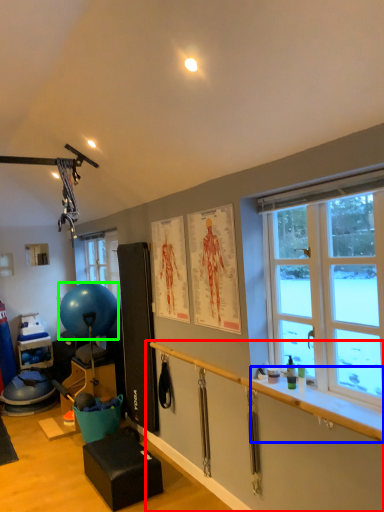
Question: Estimate the real-world distances between objects in this image. Which object is closer to garage door (highlighted by a red box), window sill (highlighted by a blue box) or ball (highlighted by a green box)?

Choices:
 (A) window sill
 (B) ball

Answer: (A)